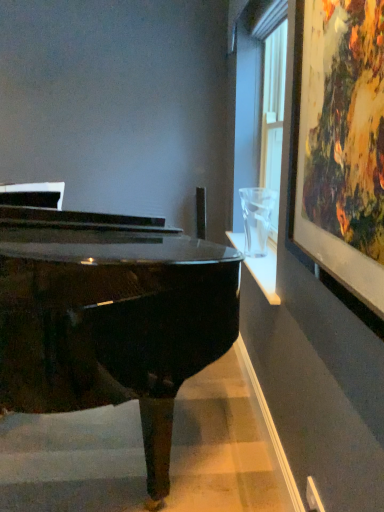
Question: Are white plastic power outlet at lower right and glossy black piano at center located far from each other?

Choices:
 (A) no
 (B) yes

Answer: (B)

Question: Does white plastic power outlet at lower right have a lesser width compared to glossy black piano at center?

Choices:
 (A) no
 (B) yes

Answer: (B)

Question: Considering the relative sizes of white plastic power outlet at lower right and glossy black piano at center in the image provided, is white plastic power outlet at lower right shorter than glossy black piano at center?

Choices:
 (A) yes
 (B) no

Answer: (A)

Question: From the image's perspective, is white plastic power outlet at lower right located above glossy black piano at center?

Choices:
 (A) no
 (B) yes

Answer: (A)

Question: Is white plastic power outlet at lower right further to the viewer compared to glossy black piano at center?

Choices:
 (A) no
 (B) yes

Answer: (B)

Question: Does white plastic power outlet at lower right have a greater height compared to glossy black piano at center?

Choices:
 (A) yes
 (B) no

Answer: (B)

Question: Is glossy black piano at center next to white plastic power outlet at lower right?

Choices:
 (A) no
 (B) yes

Answer: (A)

Question: From the image's perspective, does glossy black piano at center appear higher than white plastic power outlet at lower right?

Choices:
 (A) yes
 (B) no

Answer: (A)

Question: Does glossy black piano at center lie behind white plastic power outlet at lower right?

Choices:
 (A) no
 (B) yes

Answer: (A)

Question: Is glossy black piano at center far away from white plastic power outlet at lower right?

Choices:
 (A) yes
 (B) no

Answer: (A)

Question: Can white plastic power outlet at lower right be found inside glossy black piano at center?

Choices:
 (A) yes
 (B) no

Answer: (B)

Question: From the image's perspective, would you say glossy black piano at center is shown under white plastic power outlet at lower right?

Choices:
 (A) no
 (B) yes

Answer: (A)

Question: Are white plastic power outlet at lower right and wooden framed artwork at upper right located far from each other?

Choices:
 (A) yes
 (B) no

Answer: (A)